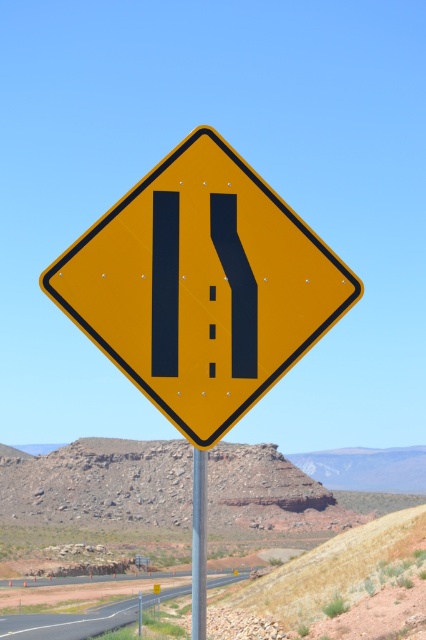
Is point (339, 260) positioned after point (124, 600)?

No, (339, 260) is closer to viewer.

Is yellow matte road sign at center closer to camera compared to asphalt road at lower center?

Yes, it is.

This screenshot has width=426, height=640. Identify the location of yellow matte road sign at center. (201, 285).

Consider the image. Does yellow matte road sign at center have a lesser height compared to metallic silver pole at center?

Indeed, yellow matte road sign at center has a lesser height compared to metallic silver pole at center.

Based on the photo, can you confirm if yellow matte road sign at center is wider than metallic silver pole at center?

No.

At what (x,y) coordinates should I click in order to perform the action: click on yellow matte road sign at center. Please return your answer as a coordinate pair (x, y). The height and width of the screenshot is (640, 426). Looking at the image, I should click on (201, 285).

Between point (129, 618) and point (193, 598), which one is positioned behind?

The point (129, 618) is behind.

Does point (143, 602) lie in front of point (192, 460)?

Yes, it is.

Where is `asphalt road at lower center`? asphalt road at lower center is located at coordinates (69, 621).